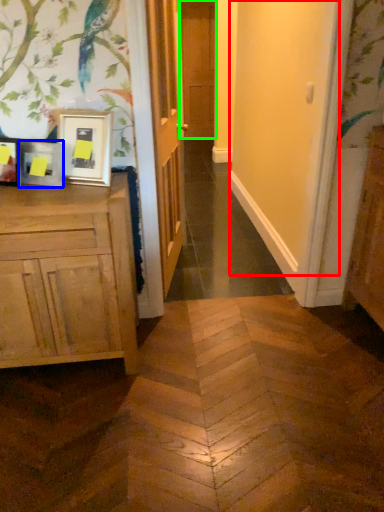
Question: Which object is positioned closest to screen door (highlighted by a red box)? Select from picture frame (highlighted by a blue box) and door (highlighted by a green box).

Choices:
 (A) picture frame
 (B) door

Answer: (A)